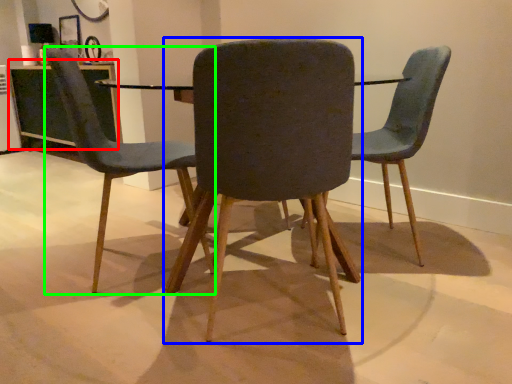
Question: Which object is the farthest from table (highlighted by a red box)? Choose among these: chair (highlighted by a blue box) or chair (highlighted by a green box).

Choices:
 (A) chair
 (B) chair

Answer: (A)